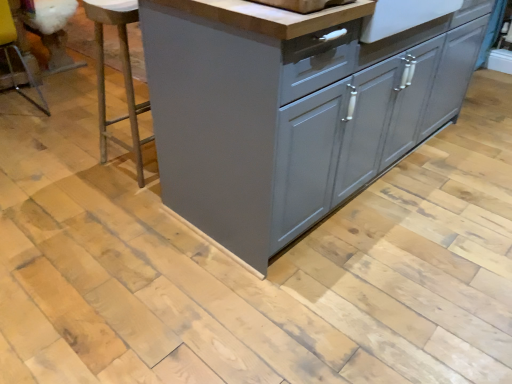
What is the approximate width of clear plastic bar stool at left, the first bar stool viewed from the left?

The width of clear plastic bar stool at left, the first bar stool viewed from the left, is 20.94 inches.

Where is `clear plastic bar stool at left, the first bar stool viewed from the left`? This screenshot has height=384, width=512. clear plastic bar stool at left, the first bar stool viewed from the left is located at coordinates (16, 52).

From the image's perspective, who appears lower, clear plastic bar stool at left, the second bar stool viewed from the right, or metallic silver bar stool at left, acting as the 2th bar stool starting from the left?

metallic silver bar stool at left, acting as the 2th bar stool starting from the left, is shown below in the image.

Is clear plastic bar stool at left, the first bar stool viewed from the left, positioned beyond the bounds of metallic silver bar stool at left, acting as the 2th bar stool starting from the left?

Yes, clear plastic bar stool at left, the first bar stool viewed from the left, is outside of metallic silver bar stool at left, acting as the 2th bar stool starting from the left.

Looking at their sizes, would you say clear plastic bar stool at left, the first bar stool viewed from the left, is wider or thinner than metallic silver bar stool at left, which is counted as the first bar stool, starting from the right?

Clearly, clear plastic bar stool at left, the first bar stool viewed from the left, has more width compared to metallic silver bar stool at left, which is counted as the first bar stool, starting from the right.

From a real-world perspective, does clear plastic bar stool at left, the second bar stool viewed from the right, sit lower than metallic silver bar stool at left, which is counted as the first bar stool, starting from the right?

Yes.

Does matte gray cabinet at center have a greater height compared to metallic silver bar stool at left, which is counted as the first bar stool, starting from the right?

Indeed, matte gray cabinet at center has a greater height compared to metallic silver bar stool at left, which is counted as the first bar stool, starting from the right.

Could you tell me if matte gray cabinet at center is turned towards metallic silver bar stool at left, acting as the 2th bar stool starting from the left?

Yes, matte gray cabinet at center is aimed at metallic silver bar stool at left, acting as the 2th bar stool starting from the left.

Considering their positions, is matte gray cabinet at center located in front of or behind metallic silver bar stool at left, which is counted as the first bar stool, starting from the right?

matte gray cabinet at center is positioned closer to the viewer than metallic silver bar stool at left, which is counted as the first bar stool, starting from the right.

From the image's perspective, who appears lower, matte gray cabinet at center or metallic silver bar stool at left, which is counted as the first bar stool, starting from the right?

metallic silver bar stool at left, which is counted as the first bar stool, starting from the right.

Can you confirm if metallic silver bar stool at left, which is counted as the first bar stool, starting from the right, is shorter than matte gray cabinet at center?

Correct, metallic silver bar stool at left, which is counted as the first bar stool, starting from the right, is not as tall as matte gray cabinet at center.

Considering the sizes of objects metallic silver bar stool at left, acting as the 2th bar stool starting from the left, and matte gray cabinet at center in the image provided, who is thinner, metallic silver bar stool at left, acting as the 2th bar stool starting from the left, or matte gray cabinet at center?

metallic silver bar stool at left, acting as the 2th bar stool starting from the left.

Which point is more forward, (98, 72) or (237, 141)?

Positioned in front is point (237, 141).

Is metallic silver bar stool at left, acting as the 2th bar stool starting from the left, positioned far away from matte gray cabinet at center?

No, metallic silver bar stool at left, acting as the 2th bar stool starting from the left, is in close proximity to matte gray cabinet at center.

From the picture: How different are the orientations of clear plastic bar stool at left, the first bar stool viewed from the left, and matte gray cabinet at center in degrees?

The angular difference between clear plastic bar stool at left, the first bar stool viewed from the left, and matte gray cabinet at center is 1.12 degrees.

The image size is (512, 384). What are the coordinates of `the chest of drawers positioned vertically above the clear plastic bar stool at left, the second bar stool viewed from the right (from a real-world perspective)` in the screenshot? It's located at (290, 112).

Between clear plastic bar stool at left, the first bar stool viewed from the left, and matte gray cabinet at center, which one has larger width?

With larger width is matte gray cabinet at center.

Can you confirm if clear plastic bar stool at left, the second bar stool viewed from the right, is taller than matte gray cabinet at center?

No.

Can you tell me how much matte gray cabinet at center and clear plastic bar stool at left, the first bar stool viewed from the left, differ in facing direction?

The facing directions of matte gray cabinet at center and clear plastic bar stool at left, the first bar stool viewed from the left, are 1.12 degrees apart.

From a real-world perspective, between matte gray cabinet at center and clear plastic bar stool at left, the second bar stool viewed from the right, who is vertically lower?

clear plastic bar stool at left, the second bar stool viewed from the right, from a real-world perspective.

Is matte gray cabinet at center looking in the opposite direction of clear plastic bar stool at left, the second bar stool viewed from the right?

matte gray cabinet at center is not turned away from clear plastic bar stool at left, the second bar stool viewed from the right.

Is matte gray cabinet at center in contact with clear plastic bar stool at left, the second bar stool viewed from the right?

matte gray cabinet at center and clear plastic bar stool at left, the second bar stool viewed from the right, are clearly separated.

Is metallic silver bar stool at left, which is counted as the first bar stool, starting from the right, with clear plastic bar stool at left, the second bar stool viewed from the right?

There is a gap between metallic silver bar stool at left, which is counted as the first bar stool, starting from the right, and clear plastic bar stool at left, the second bar stool viewed from the right.

Is the depth of metallic silver bar stool at left, which is counted as the first bar stool, starting from the right, less than that of clear plastic bar stool at left, the first bar stool viewed from the left?

Yes, it is in front of clear plastic bar stool at left, the first bar stool viewed from the left.

From a real-world perspective, which object stands above the other?

metallic silver bar stool at left, acting as the 2th bar stool starting from the left, from a real-world perspective.

There is a clear plastic bar stool at left, the first bar stool viewed from the left. Where is `bar stool above it (from a real-world perspective)`? The width and height of the screenshot is (512, 384). bar stool above it (from a real-world perspective) is located at coordinates (123, 74).

The image size is (512, 384). Find the location of `bar stool on the right of clear plastic bar stool at left, the second bar stool viewed from the right`. bar stool on the right of clear plastic bar stool at left, the second bar stool viewed from the right is located at coordinates (123, 74).

What are the coordinates of `bar stool that is the 1st one when counting backward from the matte gray cabinet at center` in the screenshot? It's located at (123, 74).

When comparing their distances from matte gray cabinet at center, does metallic silver bar stool at left, acting as the 2th bar stool starting from the left, or clear plastic bar stool at left, the first bar stool viewed from the left, seem closer?

metallic silver bar stool at left, acting as the 2th bar stool starting from the left, lies closer to matte gray cabinet at center than the other object.

Based on their spatial positions, is metallic silver bar stool at left, acting as the 2th bar stool starting from the left, or matte gray cabinet at center further from clear plastic bar stool at left, the first bar stool viewed from the left?

matte gray cabinet at center lies further to clear plastic bar stool at left, the first bar stool viewed from the left, than the other object.

When comparing their distances from clear plastic bar stool at left, the first bar stool viewed from the left, does matte gray cabinet at center or metallic silver bar stool at left, which is counted as the first bar stool, starting from the right, seem further?

The object further to clear plastic bar stool at left, the first bar stool viewed from the left, is matte gray cabinet at center.

From the picture: Estimate the real-world distances between objects in this image. Which object is further from matte gray cabinet at center, clear plastic bar stool at left, the second bar stool viewed from the right, or metallic silver bar stool at left, which is counted as the first bar stool, starting from the right?

clear plastic bar stool at left, the second bar stool viewed from the right, lies further to matte gray cabinet at center than the other object.

Based on their spatial positions, is matte gray cabinet at center or clear plastic bar stool at left, the second bar stool viewed from the right, further from metallic silver bar stool at left, acting as the 2th bar stool starting from the left?

Among the two, clear plastic bar stool at left, the second bar stool viewed from the right, is located further to metallic silver bar stool at left, acting as the 2th bar stool starting from the left.

Estimate the real-world distances between objects in this image. Which object is further from metallic silver bar stool at left, acting as the 2th bar stool starting from the left, clear plastic bar stool at left, the second bar stool viewed from the right, or matte gray cabinet at center?

Among the two, clear plastic bar stool at left, the second bar stool viewed from the right, is located further to metallic silver bar stool at left, acting as the 2th bar stool starting from the left.

Where is `bar stool between clear plastic bar stool at left, the second bar stool viewed from the right, and matte gray cabinet at center`? Image resolution: width=512 pixels, height=384 pixels. bar stool between clear plastic bar stool at left, the second bar stool viewed from the right, and matte gray cabinet at center is located at coordinates (123, 74).